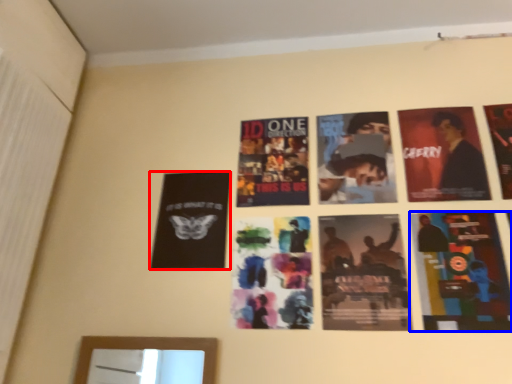
Question: Which object appears closest to the camera in this image, poster (highlighted by a red box) or poster (highlighted by a blue box)?

Choices:
 (A) poster
 (B) poster

Answer: (B)